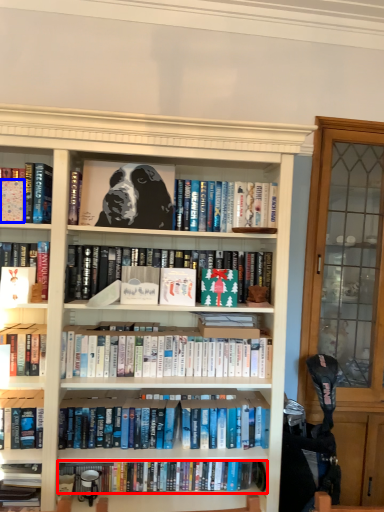
Question: Which object appears farthest to the camera in this image, book (highlighted by a red box) or paperback book (highlighted by a blue box)?

Choices:
 (A) book
 (B) paperback book

Answer: (A)